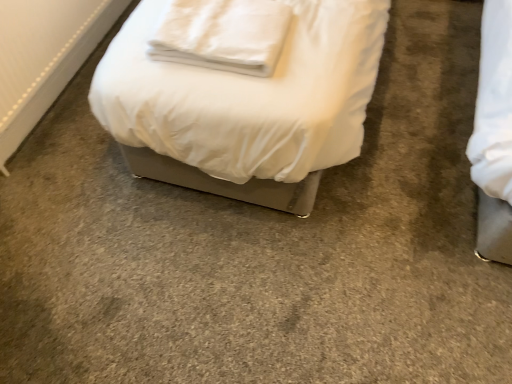
Question: Is white fabric radiator at lower left not within white soft pillow at upper center?

Choices:
 (A) yes
 (B) no

Answer: (A)

Question: Does white fabric radiator at lower left have a larger size compared to white soft pillow at upper center?

Choices:
 (A) no
 (B) yes

Answer: (A)

Question: Is white fabric radiator at lower left at the right side of white soft pillow at upper center?

Choices:
 (A) no
 (B) yes

Answer: (A)

Question: From a real-world perspective, is white fabric radiator at lower left positioned under white soft pillow at upper center based on gravity?

Choices:
 (A) yes
 (B) no

Answer: (A)

Question: Is white fabric radiator at lower left looking in the opposite direction of white soft pillow at upper center?

Choices:
 (A) yes
 (B) no

Answer: (B)

Question: From the image's perspective, is white fabric radiator at lower left above white soft pillow at upper center?

Choices:
 (A) no
 (B) yes

Answer: (B)

Question: From a real-world perspective, is white soft pillow at upper center over white fabric radiator at lower left?

Choices:
 (A) no
 (B) yes

Answer: (B)

Question: Is white soft pillow at upper center shorter than white fabric radiator at lower left?

Choices:
 (A) no
 (B) yes

Answer: (A)

Question: Is white soft pillow at upper center to the left of white fabric radiator at lower left from the viewer's perspective?

Choices:
 (A) yes
 (B) no

Answer: (B)

Question: From the image's perspective, does white soft pillow at upper center appear lower than white fabric radiator at lower left?

Choices:
 (A) yes
 (B) no

Answer: (A)

Question: Considering the relative sizes of white soft pillow at upper center and white fabric radiator at lower left in the image provided, is white soft pillow at upper center taller than white fabric radiator at lower left?

Choices:
 (A) no
 (B) yes

Answer: (B)

Question: Is white soft pillow at upper center to the right of white fabric radiator at lower left from the viewer's perspective?

Choices:
 (A) yes
 (B) no

Answer: (A)

Question: Is point (280, 18) closer or farther from the camera than point (81, 3)?

Choices:
 (A) closer
 (B) farther

Answer: (A)